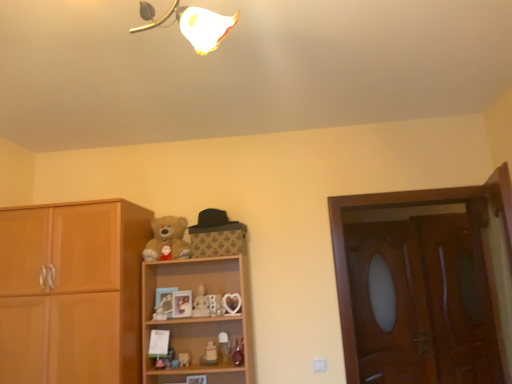
Question: Can you see matte plastic teddy bear at center, the 5th toy when ordered from right to left, touching white porcelain figurine at center, the third toy positioned from the right?

Choices:
 (A) yes
 (B) no

Answer: (B)

Question: Is matte plastic teddy bear at center, marked as the first toy in a left-to-right arrangement, positioned far away from white porcelain figurine at center, the third toy viewed from the left?

Choices:
 (A) yes
 (B) no

Answer: (B)

Question: Is matte plastic teddy bear at center, marked as the first toy in a left-to-right arrangement, thinner than white porcelain figurine at center, the third toy positioned from the right?

Choices:
 (A) yes
 (B) no

Answer: (B)

Question: Does matte plastic teddy bear at center, the 5th toy when ordered from right to left, come in front of white porcelain figurine at center, the third toy viewed from the left?

Choices:
 (A) no
 (B) yes

Answer: (B)

Question: Is matte plastic teddy bear at center, the 5th toy when ordered from right to left, smaller than white porcelain figurine at center, the third toy viewed from the left?

Choices:
 (A) yes
 (B) no

Answer: (A)

Question: From a real-world perspective, does matte plastic teddy bear at center, the 5th toy when ordered from right to left, stand above white porcelain figurine at center, the third toy positioned from the right?

Choices:
 (A) no
 (B) yes

Answer: (A)

Question: Considering the relative sizes of bleached cotton teddy bear at center and brown wooden screen door at right, the 1th screen door positioned from the right, in the image provided, is bleached cotton teddy bear at center thinner than brown wooden screen door at right, the 1th screen door positioned from the right,?

Choices:
 (A) no
 (B) yes

Answer: (A)

Question: Is the surface of bleached cotton teddy bear at center in direct contact with brown wooden screen door at right, the 1th screen door positioned from the right?

Choices:
 (A) yes
 (B) no

Answer: (B)

Question: Can you confirm if bleached cotton teddy bear at center is positioned to the left of brown wooden screen door at right, the 1th screen door positioned from the right?

Choices:
 (A) yes
 (B) no

Answer: (A)

Question: Is bleached cotton teddy bear at center positioned with its back to brown wooden screen door at right, the second screen door positioned from the left?

Choices:
 (A) yes
 (B) no

Answer: (B)

Question: From a real-world perspective, is bleached cotton teddy bear at center beneath brown wooden screen door at right, the 1th screen door positioned from the right?

Choices:
 (A) yes
 (B) no

Answer: (B)

Question: Is bleached cotton teddy bear at center wider than brown wooden screen door at right, the second screen door positioned from the left?

Choices:
 (A) no
 (B) yes

Answer: (B)

Question: Can you confirm if matte plastic cat at center, marked as the 4th toy in a right-to-left arrangement, is smaller than wooden screen door at right, marked as the 2th screen door in a right-to-left arrangement?

Choices:
 (A) yes
 (B) no

Answer: (A)